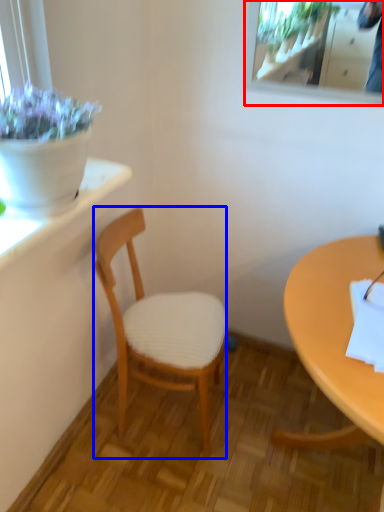
Question: Among these objects, which one is nearest to the camera, mirror (highlighted by a red box) or chair (highlighted by a blue box)?

Choices:
 (A) mirror
 (B) chair

Answer: (B)